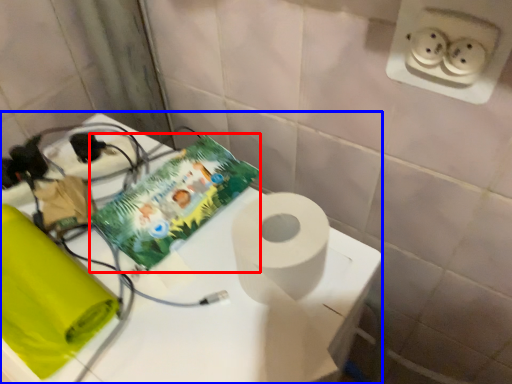
Question: Among these objects, which one is farthest to the camera, comic book (highlighted by a red box) or table (highlighted by a blue box)?

Choices:
 (A) comic book
 (B) table

Answer: (A)